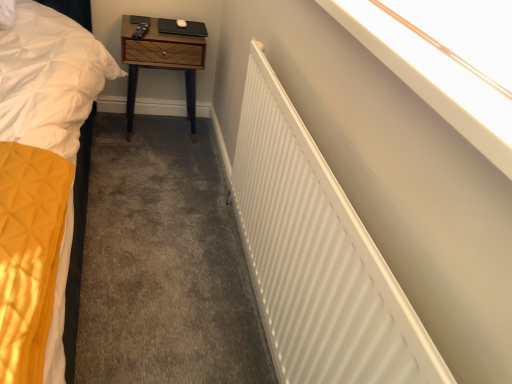
Question: From the image's perspective, is white matte radiator at upper right on woodenmaterial/texturenightstand at upper center?

Choices:
 (A) yes
 (B) no

Answer: (B)

Question: Does white matte radiator at upper right appear on the left side of woodenmaterial/texturenightstand at upper center?

Choices:
 (A) no
 (B) yes

Answer: (A)

Question: Considering the relative positions of white matte radiator at upper right and woodenmaterial/texturenightstand at upper center in the image provided, is white matte radiator at upper right to the right of woodenmaterial/texturenightstand at upper center from the viewer's perspective?

Choices:
 (A) yes
 (B) no

Answer: (A)

Question: Is white matte radiator at upper right further to camera compared to woodenmaterial/texturenightstand at upper center?

Choices:
 (A) no
 (B) yes

Answer: (A)

Question: Is white matte radiator at upper right thinner than woodenmaterial/texturenightstand at upper center?

Choices:
 (A) no
 (B) yes

Answer: (B)

Question: Is white matte radiator at upper right looking in the opposite direction of woodenmaterial/texturenightstand at upper center?

Choices:
 (A) no
 (B) yes

Answer: (A)

Question: Can you confirm if white matte radiator at upper right is positioned to the left of white smooth wall at upper right?

Choices:
 (A) yes
 (B) no

Answer: (A)

Question: Considering the relative sizes of white matte radiator at upper right and white smooth wall at upper right in the image provided, is white matte radiator at upper right shorter than white smooth wall at upper right?

Choices:
 (A) no
 (B) yes

Answer: (A)

Question: Is white matte radiator at upper right located outside white smooth wall at upper right?

Choices:
 (A) yes
 (B) no

Answer: (A)

Question: Is white matte radiator at upper right next to white smooth wall at upper right and touching it?

Choices:
 (A) yes
 (B) no

Answer: (B)

Question: Is white matte radiator at upper right to the right of white smooth wall at upper right from the viewer's perspective?

Choices:
 (A) yes
 (B) no

Answer: (B)

Question: Is white matte radiator at upper right far from white smooth wall at upper right?

Choices:
 (A) yes
 (B) no

Answer: (B)

Question: From a real-world perspective, is white smooth wall at upper right positioned over woodenmaterial/texturenightstand at upper center based on gravity?

Choices:
 (A) yes
 (B) no

Answer: (A)